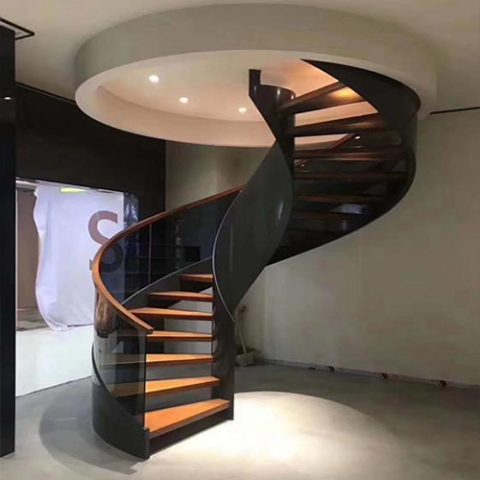
The width and height of the screenshot is (480, 480). What are the coordinates of `floor` in the screenshot? It's located at (264, 430).